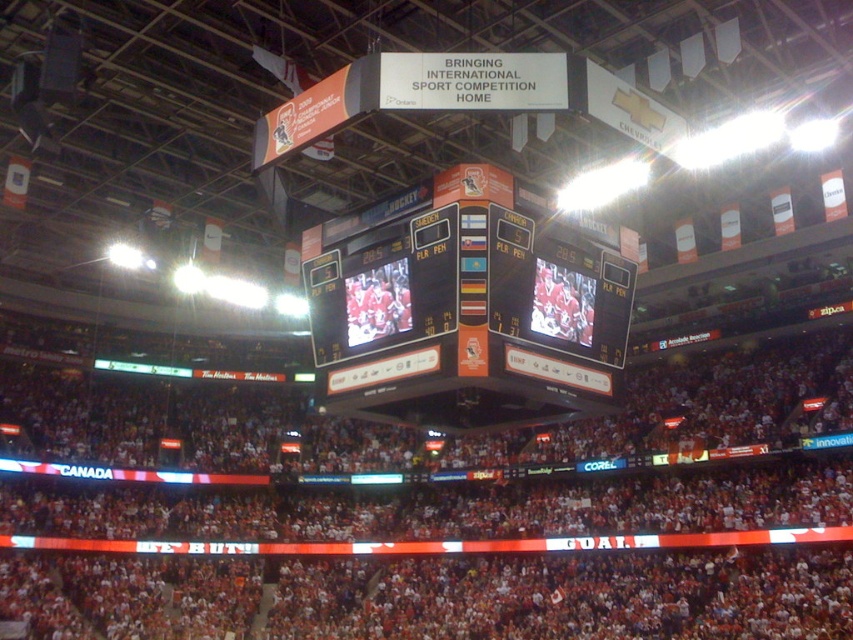
You are a drone operator trying to capture aerial footage of the Canadian supporters in the red fabric crowd at center. Your drone must fly above the orange glossy scoreboard at center to reach them. Is this possible?

The red fabric crowd at center is below the orange glossy scoreboard at center, so the drone cannot fly above the scoreboard to reach them since the crowd is already positioned beneath it.

You are a photographer positioned at the edge of the arena. You need to capture a photo of the orange glossy scoreboard at center without the red fabric crowd at center appearing in the frame. Is this possible based on their positions?

The red fabric crowd at center is to the left of the orange glossy scoreboard at center. Since the photographer is at the edge, they can adjust their angle to frame the scoreboard to the right of the crowd, excluding the crowd from the shot.